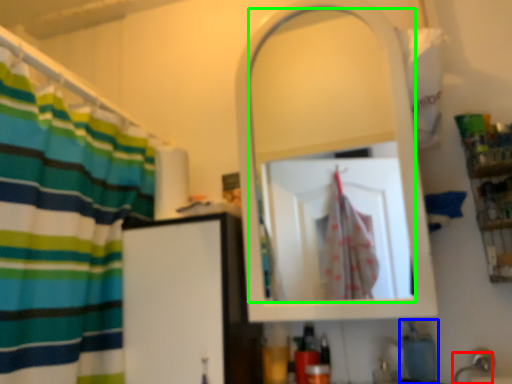
Question: Which object is the farthest from faucet (highlighted by a red box)? Choose among these: soap (highlighted by a blue box) or mirror (highlighted by a green box).

Choices:
 (A) soap
 (B) mirror

Answer: (B)